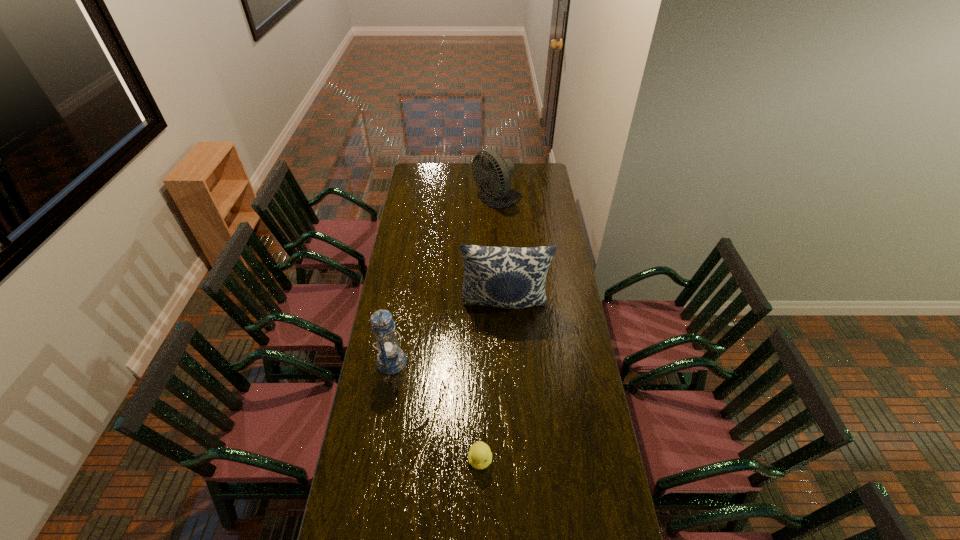
Identify the location of vacant space in between the second nearest object and the fan. The height and width of the screenshot is (540, 960). (444, 281).

In order to click on free space between the shortest object and the second nearest object in this screenshot , I will do `click(436, 410)`.

I want to click on free space between the cushion and the leftmost object, so click(448, 333).

Locate an element on the screen. free space between the cushion and the third farthest object is located at coordinates (448, 333).

Locate an element on the screen. free point between the lantern and the cushion is located at coordinates (448, 333).

Point out which object is positioned as the third nearest to the leftmost object. Please provide its 2D coordinates. Your answer should be formatted as a tuple, i.e. [(x, y)], where the tuple contains the x and y coordinates of a point satisfying the conditions above.

[(494, 179)]

At what (x,y) coordinates should I click in order to perform the action: click on the closest object to the cushion. Please return your answer as a coordinate pair (x, y). The height and width of the screenshot is (540, 960). Looking at the image, I should click on pos(391,359).

The height and width of the screenshot is (540, 960). In order to click on free region that satisfies the following two spatial constraints: 1. in front of the fan to direct airflow; 2. at the beak of the nearest object in this screenshot , I will do `click(509, 460)`.